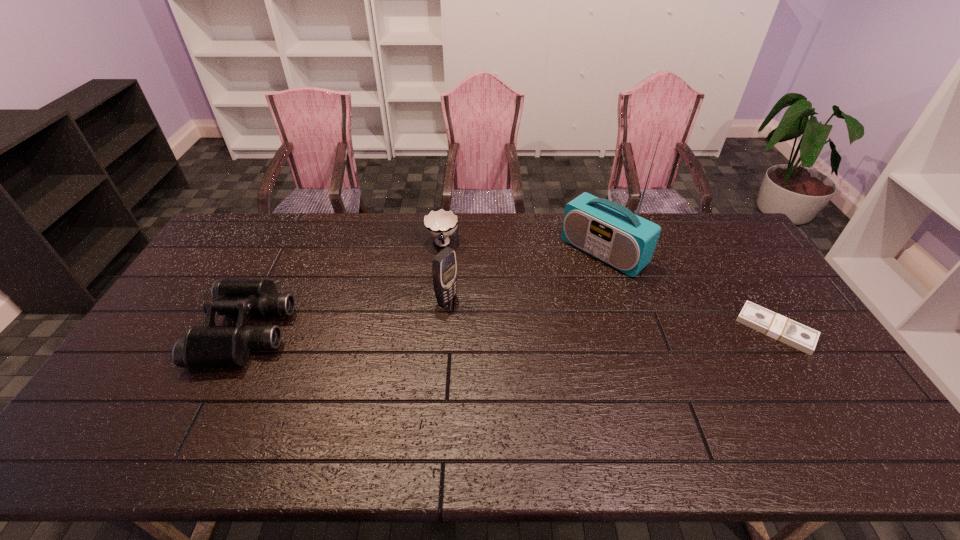
You are a GUI agent. You are given a task and a screenshot of the screen. Output one action in this format:
    pyautogui.click(x=<x>, y=<y>)
    Task: Click on the binoculars
    The image size is (960, 540).
    Given the screenshot: What is the action you would take?
    pyautogui.click(x=207, y=346)

Where is `the leftmost object`? Image resolution: width=960 pixels, height=540 pixels. the leftmost object is located at coordinates (207, 346).

Find the location of a particular element. The width and height of the screenshot is (960, 540). the shortest object is located at coordinates (774, 325).

You are a GUI agent. You are given a task and a screenshot of the screen. Output one action in this format:
    pyautogui.click(x=<x>, y=<y>)
    Task: Click on the rightmost object
    The height and width of the screenshot is (540, 960).
    Given the screenshot: What is the action you would take?
    pyautogui.click(x=774, y=325)

What are the coordinates of `the fourth object from left to right` in the screenshot? It's located at (612, 233).

Where is `radio receiver`? The height and width of the screenshot is (540, 960). radio receiver is located at coordinates (612, 233).

At what (x,y) coordinates should I click in order to perform the action: click on cellular telephone. Please return your answer as a coordinate pair (x, y). This screenshot has height=540, width=960. Looking at the image, I should click on (444, 267).

Locate an element on the screen. cup is located at coordinates (440, 224).

Image resolution: width=960 pixels, height=540 pixels. Identify the location of vacant space located 0.060m on the front-facing side of the third tallest object. (186, 330).

The width and height of the screenshot is (960, 540). I want to click on vacant space located on the front-facing side of the third tallest object, so click(190, 330).